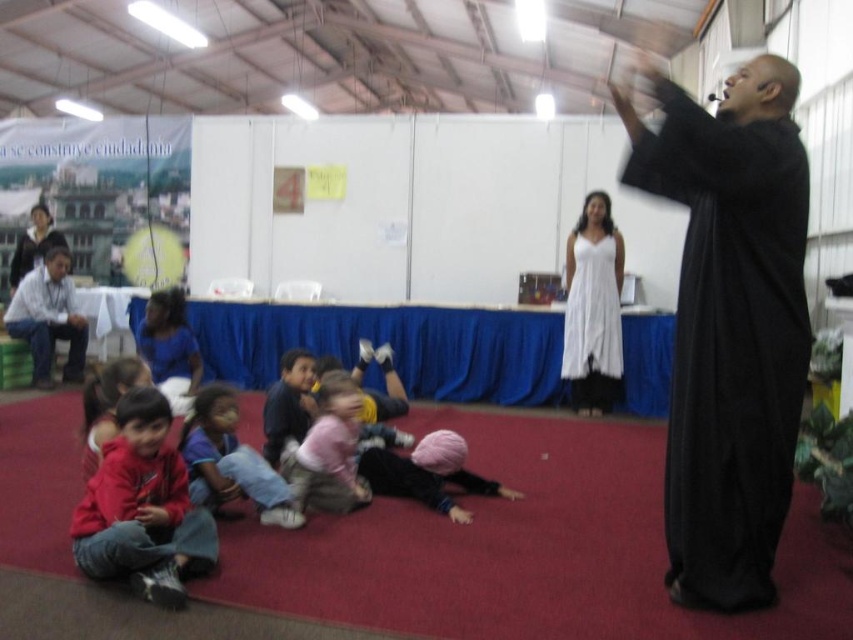
You are standing at the position of point (198, 474) and want to move to the position of point (108, 474). Which direction should you move to reach your destination?

You should move forward because point (108, 474) is in front of point (198, 474).

You are a photographer standing in the room and want to take a photo of the red fleece jacket at lower left and the pink fabric at center. Which object will appear larger in the photo?

The red fleece jacket at lower left will appear larger in the photo because it is much taller than the pink fabric at center.